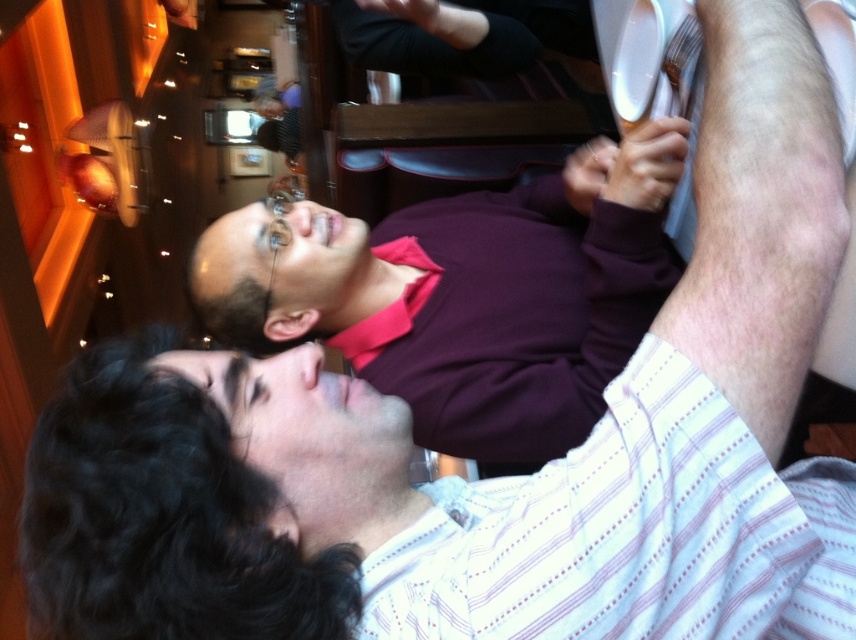
In the scene shown: Between maroon shirt at upper center and white striped shirt at upper right, which one is positioned higher?

maroon shirt at upper center is above.

Does point (672, 160) come closer to viewer compared to point (758, 576)?

No, it is not.

Between point (580, 412) and point (477, 529), which one is positioned in front?

Positioned in front is point (477, 529).

I want to click on maroon shirt at upper center, so click(465, 294).